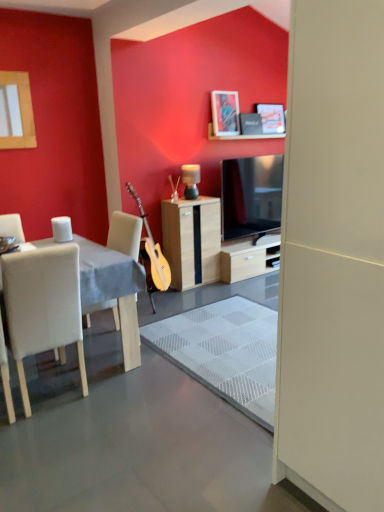
Question: Can you confirm if matte black picture frame at upper center, the 2th picture frame viewed from the front, is bigger than white leather chair at left?

Choices:
 (A) no
 (B) yes

Answer: (A)

Question: Is matte black picture frame at upper center, which ranks as the second picture frame in left-to-right order, taller than white leather chair at left?

Choices:
 (A) yes
 (B) no

Answer: (B)

Question: Considering the relative sizes of matte black picture frame at upper center, which ranks as the second picture frame in left-to-right order, and white leather chair at left in the image provided, is matte black picture frame at upper center, which ranks as the second picture frame in left-to-right order, shorter than white leather chair at left?

Choices:
 (A) no
 (B) yes

Answer: (B)

Question: Is matte black picture frame at upper center, positioned as the 1th picture frame in back-to-front order, closer to the viewer compared to white leather chair at left?

Choices:
 (A) yes
 (B) no

Answer: (B)

Question: Is matte black picture frame at upper center, positioned as the 1th picture frame in back-to-front order, thinner than white leather chair at left?

Choices:
 (A) no
 (B) yes

Answer: (B)

Question: From the image's perspective, is matte black picture frame at upper center, which ranks as the second picture frame in left-to-right order, positioned above or below white fabric table at left?

Choices:
 (A) above
 (B) below

Answer: (A)

Question: Is point (281, 121) positioned closer to the camera than point (91, 281)?

Choices:
 (A) closer
 (B) farther

Answer: (B)

Question: In terms of height, does matte black picture frame at upper center, marked as the first picture frame in a right-to-left arrangement, look taller or shorter compared to white fabric table at left?

Choices:
 (A) short
 (B) tall

Answer: (A)

Question: Considering their positions, is matte black picture frame at upper center, marked as the first picture frame in a right-to-left arrangement, located in front of or behind white fabric table at left?

Choices:
 (A) behind
 (B) front

Answer: (A)

Question: Choose the correct answer: Is white matte screen door at center inside matte black lamp at center or outside it?

Choices:
 (A) inside
 (B) outside

Answer: (B)

Question: From the image's perspective, is white matte screen door at center located above or below matte black lamp at center?

Choices:
 (A) above
 (B) below

Answer: (B)

Question: From a real-world perspective, is white matte screen door at center positioned above or below matte black lamp at center?

Choices:
 (A) above
 (B) below

Answer: (B)

Question: Considering the relative positions of white matte screen door at center and matte black lamp at center in the image provided, is white matte screen door at center to the left or to the right of matte black lamp at center?

Choices:
 (A) left
 (B) right

Answer: (B)

Question: In the image, is white glossy coffee cup at left positioned in front of or behind wooden cabinet at center?

Choices:
 (A) front
 (B) behind

Answer: (A)

Question: From the image's perspective, is white glossy coffee cup at left positioned above or below wooden cabinet at center?

Choices:
 (A) below
 (B) above

Answer: (B)